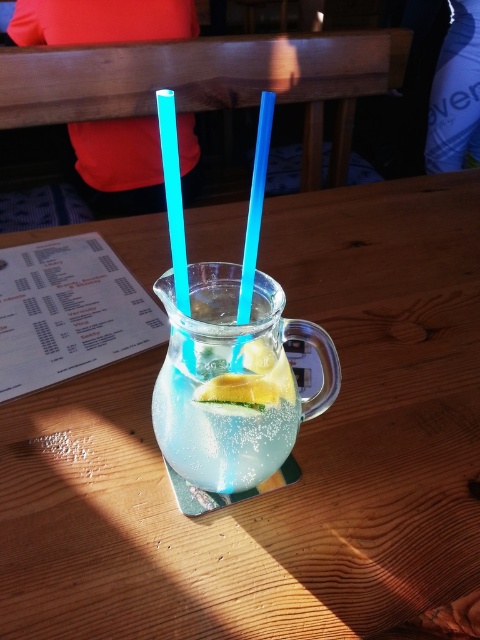
Which is more to the right, wooden table at center or yellow matte lemon at center?

Positioned to the right is yellow matte lemon at center.

Describe the element at coordinates (294, 452) in the screenshot. I see `wooden table at center` at that location.

Identify the location of wooden table at center. This screenshot has width=480, height=640. (294, 452).

Measure the distance between blue translucent straw at center and yellow matte lemon at center.

blue translucent straw at center is 6.12 centimeters away from yellow matte lemon at center.

Consider the image. Is blue translucent straw at center below yellow matte lemon at center?

No.

Where is `blue translucent straw at center`? Image resolution: width=480 pixels, height=640 pixels. blue translucent straw at center is located at coordinates (254, 205).

Can you confirm if wooden table at center is positioned below blue translucent straw at center?

No.

Is wooden table at center smaller than blue translucent straw at center?

No, wooden table at center is not smaller than blue translucent straw at center.

Image resolution: width=480 pixels, height=640 pixels. Describe the element at coordinates (294, 452) in the screenshot. I see `wooden table at center` at that location.

The image size is (480, 640). I want to click on wooden table at center, so click(294, 452).